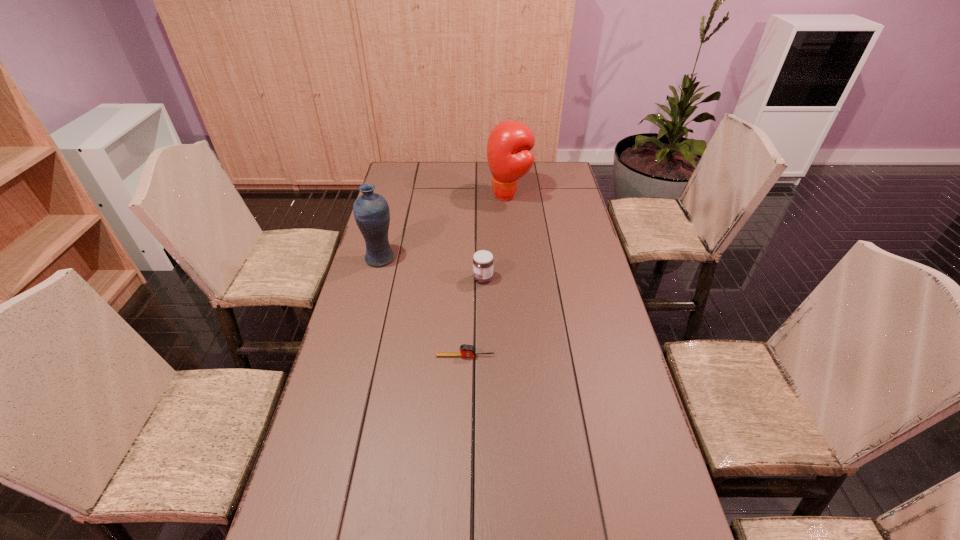
In the image, there is a desktop. Identify the location of free space at the far left corner. This screenshot has height=540, width=960. (420, 177).

I want to click on empty location between the third tallest object and the farthest object, so click(x=495, y=237).

At what (x,y) coordinates should I click in order to perform the action: click on free space between the shortest object and the second nearest object. Please return your answer as a coordinate pair (x, y). Image resolution: width=960 pixels, height=540 pixels. Looking at the image, I should click on (474, 317).

Identify the location of free area in between the boxing glove and the vase. The width and height of the screenshot is (960, 540). (444, 227).

Where is `empty space between the jam and the vase`? This screenshot has height=540, width=960. empty space between the jam and the vase is located at coordinates (432, 268).

This screenshot has width=960, height=540. Find the location of `empty space that is in between the leftmost object and the farthest object`. empty space that is in between the leftmost object and the farthest object is located at coordinates (444, 227).

At what (x,y) coordinates should I click in order to perform the action: click on free space between the vase and the jam. Please return your answer as a coordinate pair (x, y). The width and height of the screenshot is (960, 540). Looking at the image, I should click on (432, 268).

Identify the location of vacant region between the vase and the farthest object. The image size is (960, 540). (444, 227).

Locate an element on the screen. free spot between the leftmost object and the shortest object is located at coordinates (422, 307).

Where is `vacant space in between the second farthest object and the second shortest object`? Image resolution: width=960 pixels, height=540 pixels. vacant space in between the second farthest object and the second shortest object is located at coordinates (432, 268).